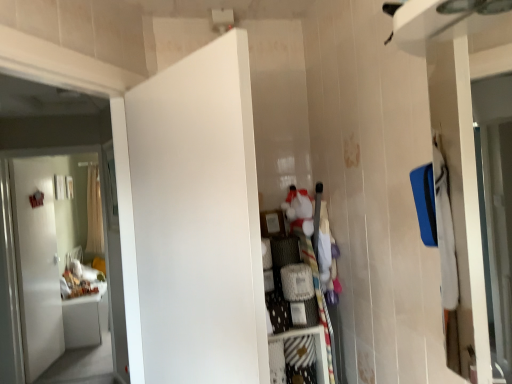
The height and width of the screenshot is (384, 512). I want to click on empty space that is ontop of white matte door at left, marked as the 2th door in a front-to-back arrangement (from a real-world perspective), so click(x=47, y=142).